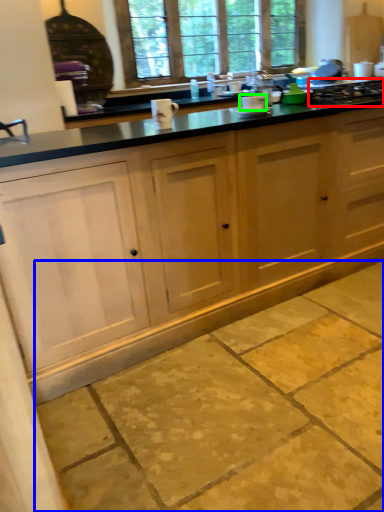
Question: Estimate the real-world distances between objects in this image. Which object is closer to gas stove (highlighted by a red box), concrete (highlighted by a blue box) or appliance (highlighted by a green box)?

Choices:
 (A) concrete
 (B) appliance

Answer: (B)